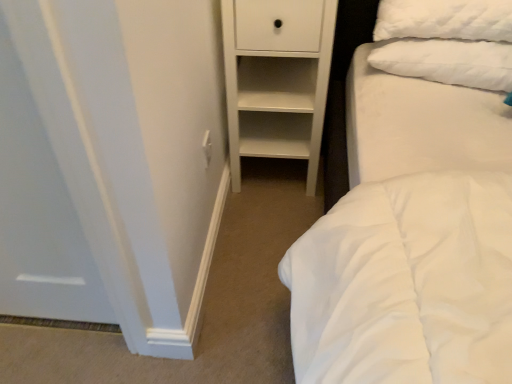
Question: Is white matte chest of drawers at center far away from white plastic electric outlet at center?

Choices:
 (A) yes
 (B) no

Answer: (B)

Question: Is white matte chest of drawers at center touching white plastic electric outlet at center?

Choices:
 (A) yes
 (B) no

Answer: (B)

Question: Considering the relative positions of white matte chest of drawers at center and white plastic electric outlet at center in the image provided, is white matte chest of drawers at center to the right of white plastic electric outlet at center from the viewer's perspective?

Choices:
 (A) yes
 (B) no

Answer: (A)

Question: From a real-world perspective, is white matte chest of drawers at center physically below white plastic electric outlet at center?

Choices:
 (A) no
 (B) yes

Answer: (B)

Question: Is white matte chest of drawers at center taller than white plastic electric outlet at center?

Choices:
 (A) no
 (B) yes

Answer: (B)

Question: Can you confirm if white matte chest of drawers at center is smaller than white plastic electric outlet at center?

Choices:
 (A) yes
 (B) no

Answer: (B)

Question: Can you confirm if white matte chest of drawers at center is thinner than white fluffy pillow at upper right?

Choices:
 (A) no
 (B) yes

Answer: (A)

Question: From a real-world perspective, is white matte chest of drawers at center physically below white fluffy pillow at upper right?

Choices:
 (A) no
 (B) yes

Answer: (B)

Question: Does white matte chest of drawers at center have a smaller size compared to white fluffy pillow at upper right?

Choices:
 (A) yes
 (B) no

Answer: (B)

Question: From the image's perspective, is white matte chest of drawers at center on top of white fluffy pillow at upper right?

Choices:
 (A) no
 (B) yes

Answer: (A)

Question: Is white matte chest of drawers at center behind white fluffy pillow at upper right?

Choices:
 (A) no
 (B) yes

Answer: (A)

Question: Is white matte chest of drawers at center placed right next to white fluffy pillow at upper right?

Choices:
 (A) yes
 (B) no

Answer: (B)

Question: From the image's perspective, is white plastic electric outlet at center above white fluffy pillow at upper right?

Choices:
 (A) yes
 (B) no

Answer: (B)